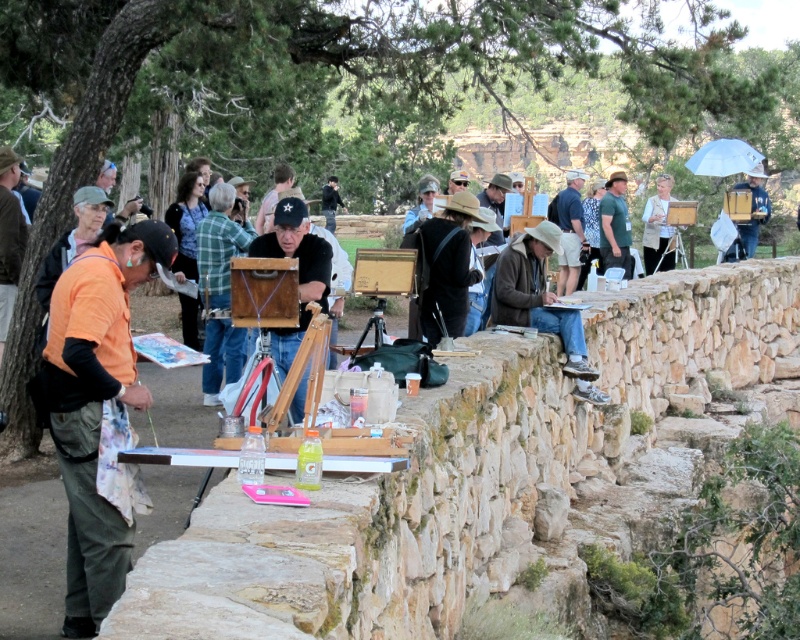
You are an artist preparing to set up your easel in the scene. You notice the matte black cap at center and the dark blue jeans at center. Which object would you choose to place your easel closer to, considering their widths?

You should place your easel closer to the matte black cap at center since it has a lesser width compared to the dark blue jeans at center, allowing for more space.

You are a photographer standing at the camera position. You want to take a closeup shot of the matte black cap at center. Can you reach it with your 100mm lens? The minimum focusing distance of your lens is 1.5 meters.

The matte black cap at center is 32.65 meters away from camera. Since the minimum focusing distance is 1.5 meters, the photographer can focus on the matte black cap at center as it is beyond the minimum distance required.

You are an artist participating in the plein air painting session. You want to place your new painting tool between the matte black cap at center and the dark blue jeans at center. Considering their heights, which object should you place the tool closer to?

The matte black cap at center has a lesser height compared to dark blue jeans at center. Therefore, you should place the tool closer to the dark blue jeans at center to ensure stability, as it is taller and provides a more secure base.